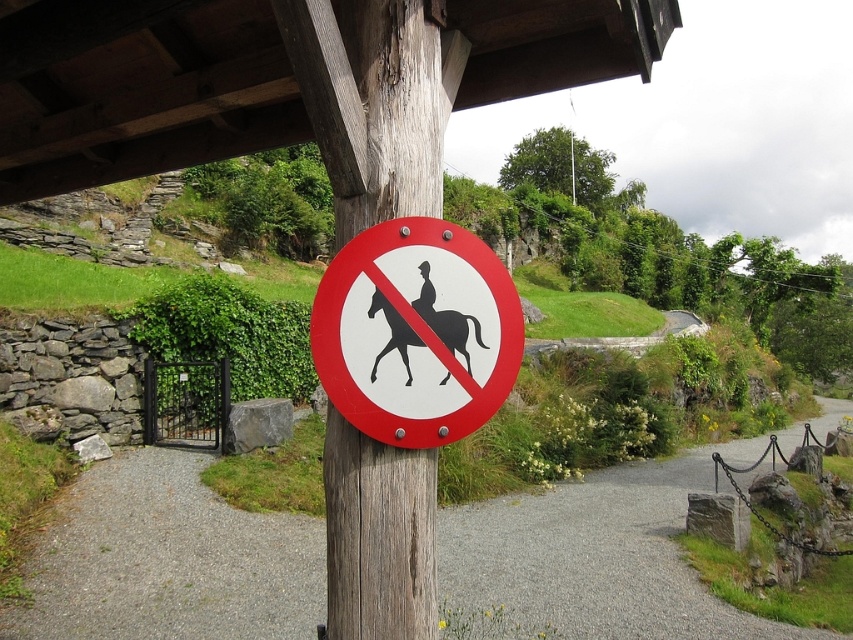
Question: Which point is farther to the camera?

Choices:
 (A) (393, 310)
 (B) (199, 554)
 (C) (404, 548)
 (D) (376, 440)

Answer: (B)

Question: Does wooden post at center have a smaller size compared to black matte horse at center?

Choices:
 (A) no
 (B) yes

Answer: (A)

Question: Which of the following is the closest to the observer?

Choices:
 (A) (450, 269)
 (B) (384, 516)
 (C) (436, 336)
 (D) (173, 620)

Answer: (C)

Question: Can you confirm if gravel path at center is positioned to the right of white paper sign at center?

Choices:
 (A) yes
 (B) no

Answer: (A)

Question: Which object is positioned farthest from the wooden post at center?

Choices:
 (A) white paper sign at center
 (B) gravel path at center
 (C) black matte horse at center

Answer: (B)

Question: Does gravel path at center have a lesser width compared to white paper sign at center?

Choices:
 (A) no
 (B) yes

Answer: (A)